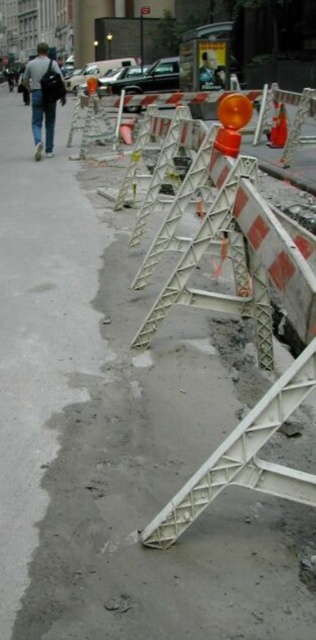
Question: Is light gray backpack at left bigger than orange reflective cone at center?

Choices:
 (A) yes
 (B) no

Answer: (A)

Question: Which of the following is the closest to the observer?

Choices:
 (A) (275, 100)
 (B) (64, 97)

Answer: (B)

Question: Can you confirm if light gray backpack at left is bigger than orange reflective cone at center?

Choices:
 (A) yes
 (B) no

Answer: (A)

Question: Is light gray backpack at left to the right of orange reflective cone at center from the viewer's perspective?

Choices:
 (A) no
 (B) yes

Answer: (A)

Question: Which of the following is the closest to the observer?

Choices:
 (A) (279, 145)
 (B) (42, 45)

Answer: (B)